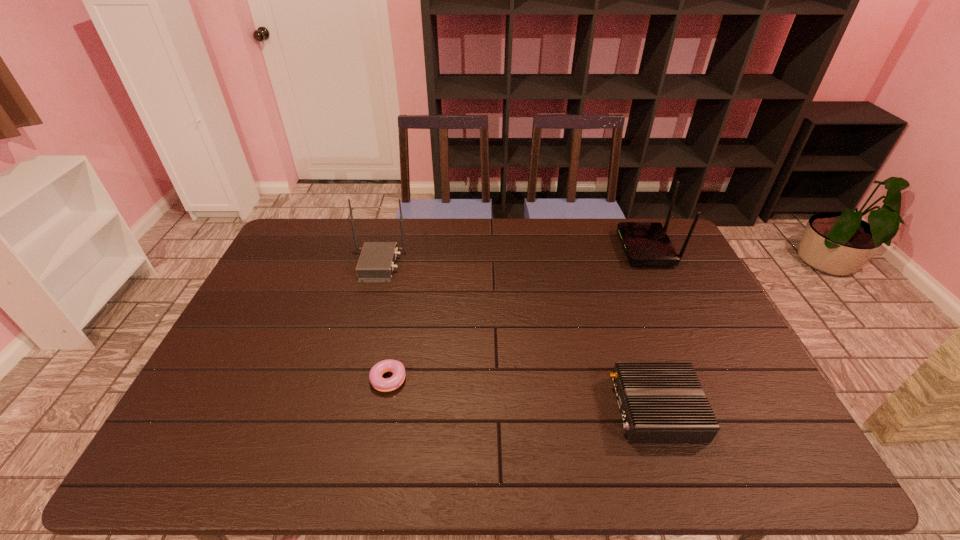
Image resolution: width=960 pixels, height=540 pixels. I want to click on vacant space that satisfies the following two spatial constraints: 1. on the back of the doughnut to connect cables; 2. on the right side of the leftmost router, so click(347, 383).